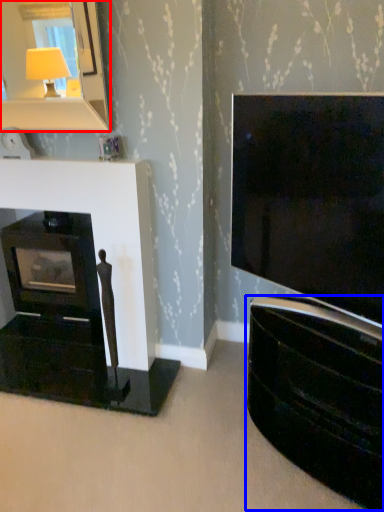
Question: Which object appears closest to the camera in this image, mirror (highlighted by a red box) or tv cabinet (highlighted by a blue box)?

Choices:
 (A) mirror
 (B) tv cabinet

Answer: (B)